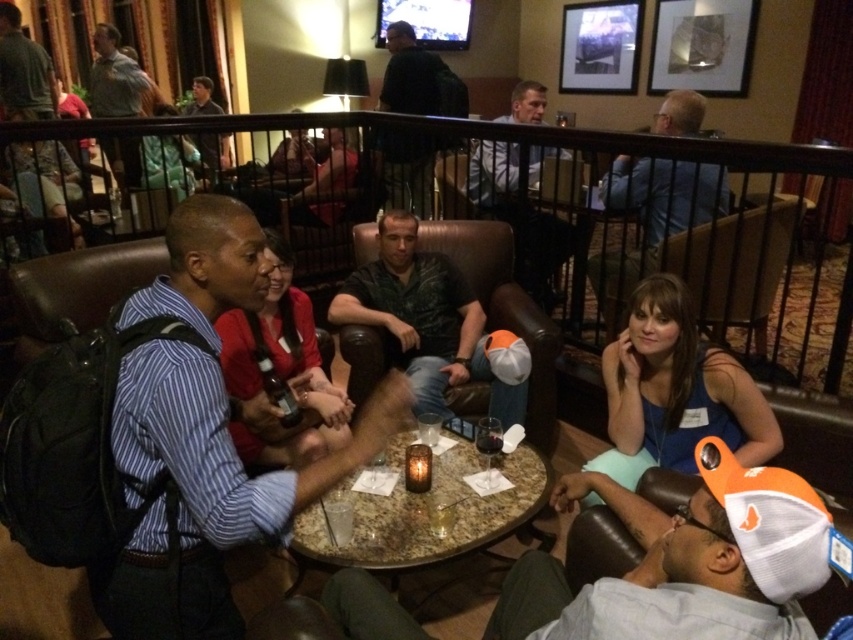
Question: Which of the following is the closest to the observer?

Choices:
 (A) coord(132,161)
 (B) coord(430,161)
 (C) coord(7,115)

Answer: (B)

Question: Is marble table at center below clear glass at table center?

Choices:
 (A) no
 (B) yes

Answer: (A)

Question: Which object appears closest to the camera in this image?

Choices:
 (A) translucent glass at table center
 (B) translucent glass candle at center
 (C) marble table at center

Answer: (C)

Question: Which of the following is the farthest from the observer?

Choices:
 (A) (39, 109)
 (B) (204, 486)
 (C) (453, 502)
 (D) (619, 632)

Answer: (A)

Question: Does light blue shirt at upper center appear under light gray shirt at upper left?

Choices:
 (A) no
 (B) yes

Answer: (B)

Question: Is green textured shirt at center wider than light gray shirt at upper left?

Choices:
 (A) no
 (B) yes

Answer: (B)